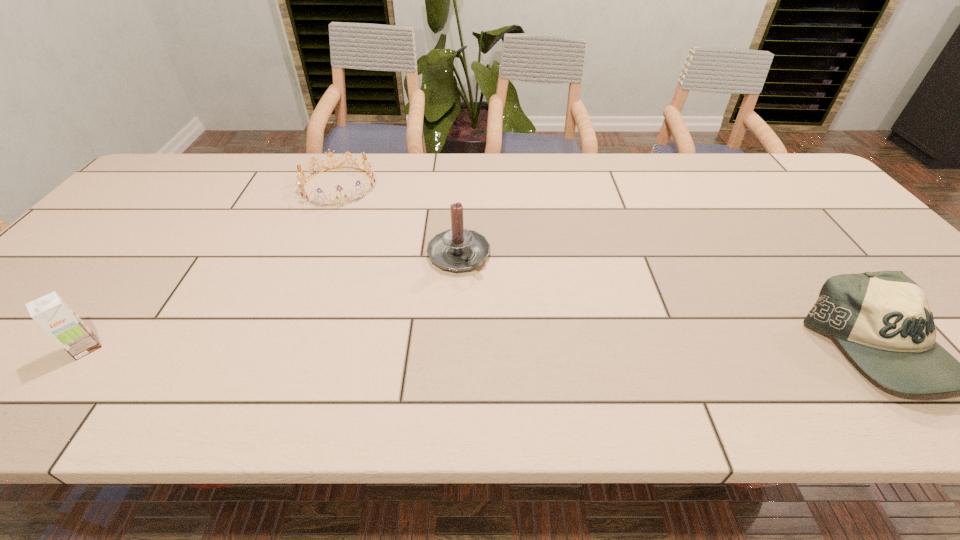
The height and width of the screenshot is (540, 960). What are the coordinates of `the leftmost object` in the screenshot? It's located at (50, 311).

The width and height of the screenshot is (960, 540). Find the location of `tiara`. tiara is located at coordinates (371, 173).

Identify the location of the farthest object. (371, 173).

I want to click on candle, so click(458, 249).

Locate an element on the screen. This screenshot has height=540, width=960. the third object from left to right is located at coordinates (458, 249).

In order to click on vacant position located 0.160m on the back of the leftmost object in this screenshot , I will do `click(137, 282)`.

Identify the location of vacant space located 0.270m on the front-facing side of the tiara. (360, 265).

Locate an element on the screen. This screenshot has width=960, height=540. free region located on the front-facing side of the tiara is located at coordinates (351, 234).

The width and height of the screenshot is (960, 540). What are the coordinates of `blank space located 0.150m on the front-facing side of the tiara` in the screenshot? It's located at (352, 237).

The image size is (960, 540). Identify the location of vacant area situated on the side of the third nearest object with the handle loop. click(x=496, y=292).